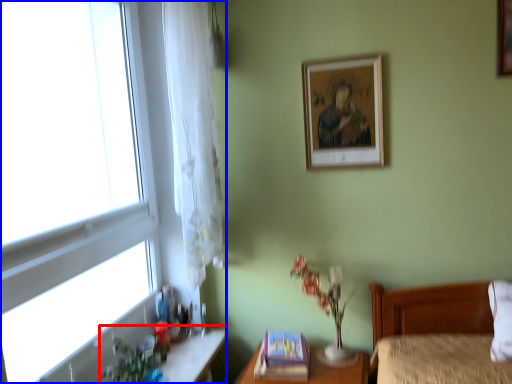
Question: Among these objects, which one is nearest to the camera, vanity (highlighted by a red box) or window (highlighted by a blue box)?

Choices:
 (A) vanity
 (B) window

Answer: (B)